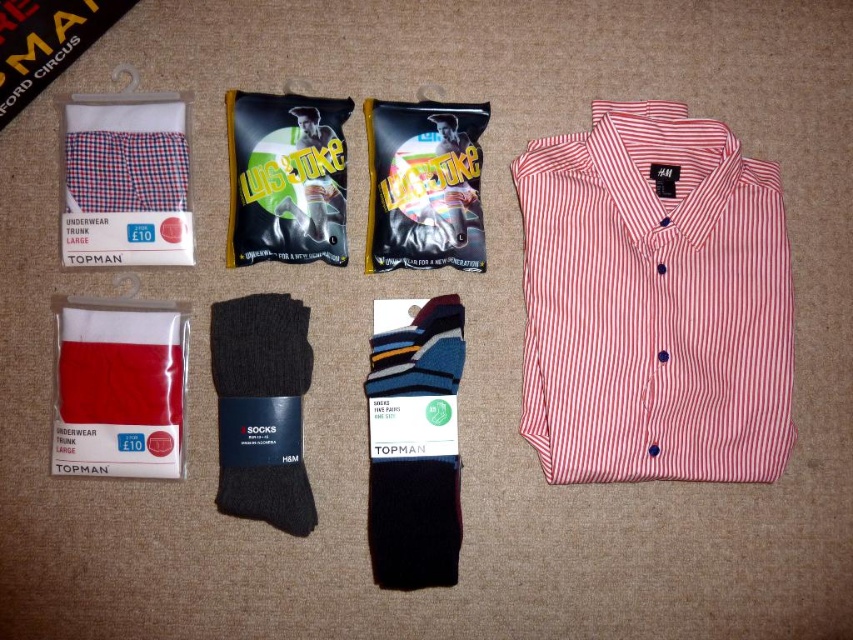
Question: Among these points, which one is nearest to the camera?

Choices:
 (A) (683, 292)
 (B) (107, 438)
 (C) (393, 547)
 (D) (236, 460)

Answer: (B)

Question: Is striped wool socks at center to the right of black wool socks at center from the viewer's perspective?

Choices:
 (A) yes
 (B) no

Answer: (A)

Question: Estimate the real-world distances between objects in this image. Which object is closer to the red cotton underwear at lower left?

Choices:
 (A) black wool socks at center
 (B) checkered fabric underwear trunk at upper left
 (C) striped wool socks at center

Answer: (A)

Question: Is checkered fabric underwear trunk at upper left thinner than black wool socks at center?

Choices:
 (A) yes
 (B) no

Answer: (B)

Question: Among these objects, which one is nearest to the camera?

Choices:
 (A) striped wool socks at center
 (B) black wool socks at center

Answer: (B)

Question: Is red striped cotton shirt at right closer to camera compared to red cotton underwear at lower left?

Choices:
 (A) no
 (B) yes

Answer: (A)